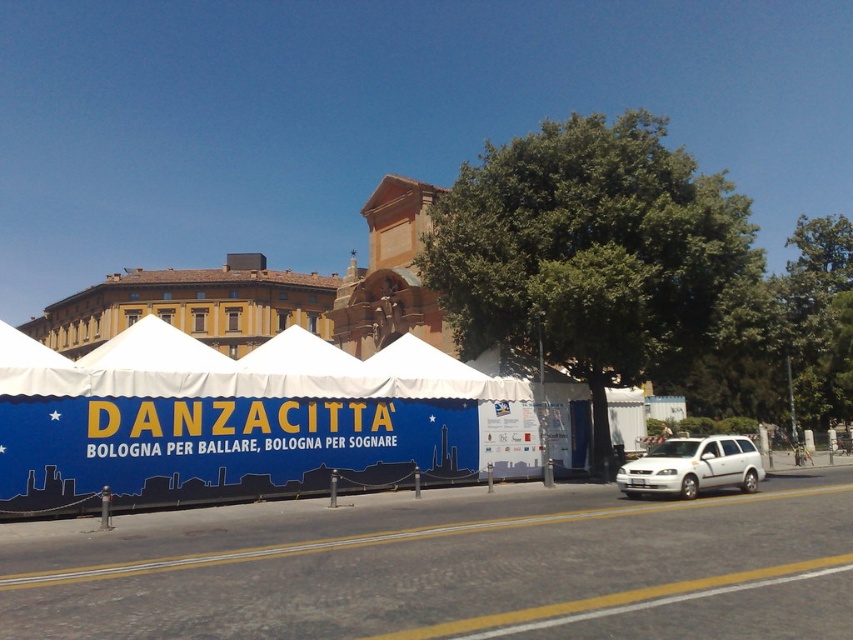
Question: Is blue fabric tent at center above white matte van at lower right?

Choices:
 (A) no
 (B) yes

Answer: (B)

Question: Among these objects, which one is nearest to the camera?

Choices:
 (A) white matte van at lower right
 (B) blue fabric tent at center

Answer: (B)

Question: Is blue fabric tent at center in front of white matte van at lower right?

Choices:
 (A) yes
 (B) no

Answer: (A)

Question: Which point is farther to the camera?

Choices:
 (A) blue fabric tent at center
 (B) white matte van at lower right

Answer: (B)

Question: Is blue fabric tent at center to the left of white matte van at lower right from the viewer's perspective?

Choices:
 (A) no
 (B) yes

Answer: (B)

Question: Which point is closer to the camera?

Choices:
 (A) (194, 486)
 (B) (654, 477)

Answer: (A)